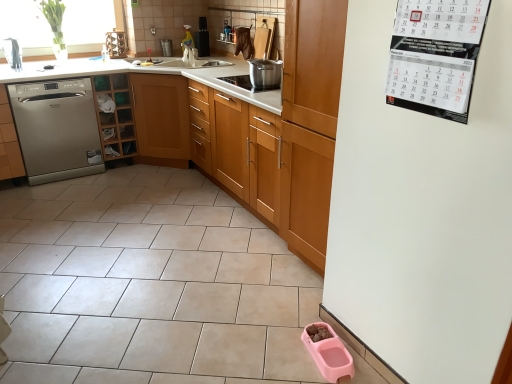
What are the coordinates of `vacant space positioned to the left of pink plastic pet food bowl at lower right` in the screenshot? It's located at (280, 349).